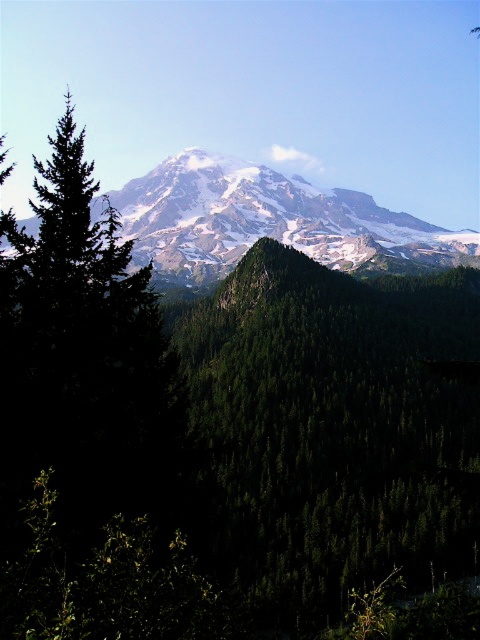
Question: Does green matte tree at center have a larger size compared to snowy granite mountain range at upper center?

Choices:
 (A) no
 (B) yes

Answer: (A)

Question: Which point is closer to the camera?

Choices:
 (A) (147, 220)
 (B) (271, 589)

Answer: (B)

Question: Is green matte tree at center positioned behind snowy granite mountain range at upper center?

Choices:
 (A) no
 (B) yes

Answer: (A)

Question: Is green matte tree at center positioned in front of snowy granite mountain range at upper center?

Choices:
 (A) yes
 (B) no

Answer: (A)

Question: Which of the following is the farthest from the observer?

Choices:
 (A) (336, 285)
 (B) (402, 241)

Answer: (B)

Question: Which object is farther from the camera taking this photo?

Choices:
 (A) snowy granite mountain range at upper center
 (B) green matte tree at center

Answer: (A)